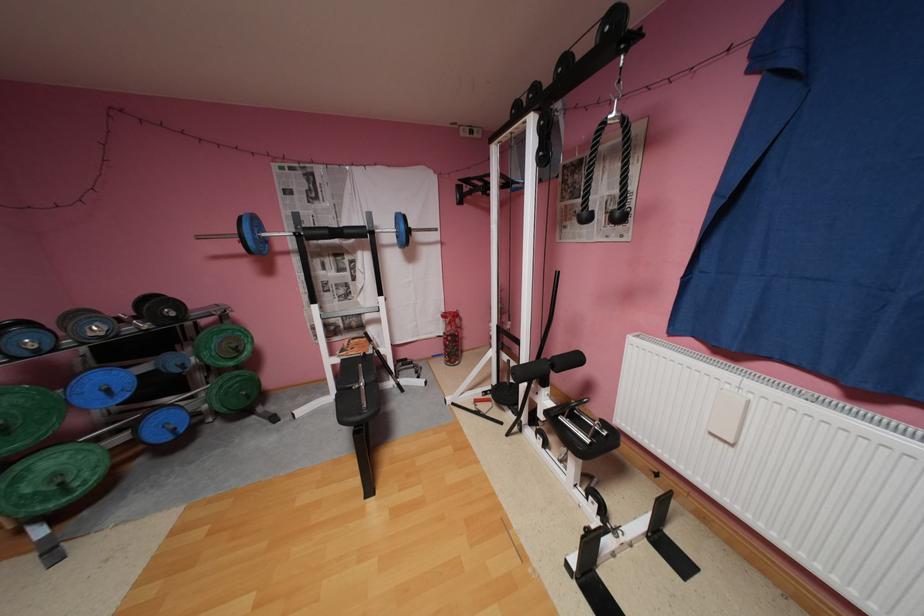
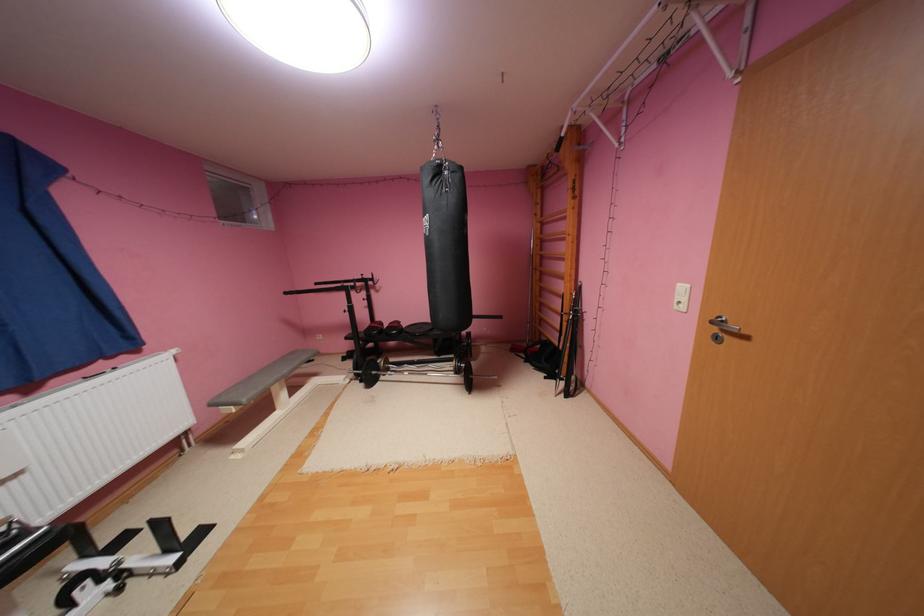
The point at (721,434) is marked in the first image. Where is the corresponding point in the second image?

(11, 483)